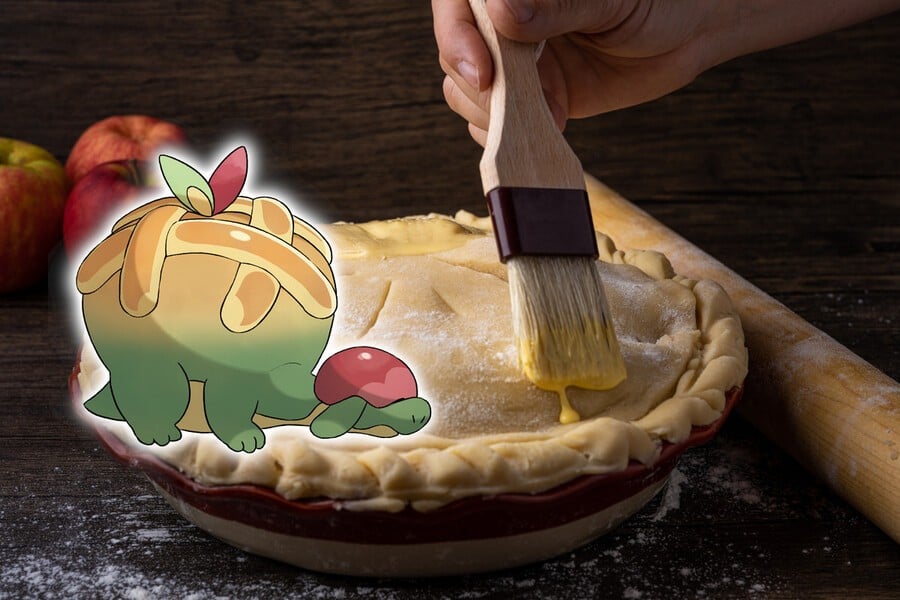
Locate an element on the screen. Image resolution: width=900 pixels, height=600 pixels. rolling pin is located at coordinates (839, 420), (646, 225).